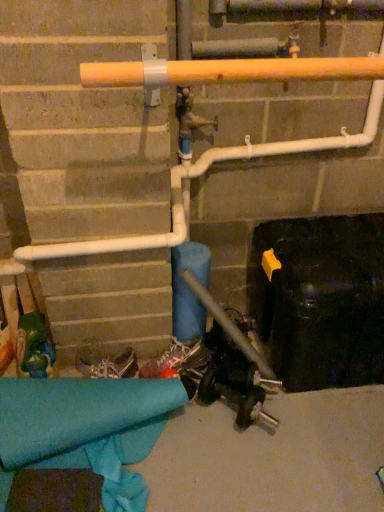
Describe the element at coordinates (170, 358) in the screenshot. The height and width of the screenshot is (512, 384). I see `white textured sneakers at center` at that location.

Where is `white textured sneakers at center`? This screenshot has width=384, height=512. white textured sneakers at center is located at coordinates (170, 358).

In order to face matte orange pipe at upper center, should I rotate leftwards or rightwards?

A 8.611 degree turn to the right will do.

Image resolution: width=384 pixels, height=512 pixels. What do you see at coordinates (229, 71) in the screenshot?
I see `matte orange pipe at upper center` at bounding box center [229, 71].

Find the location of a particular element. matte orange pipe at upper center is located at coordinates (229, 71).

This screenshot has height=512, width=384. Find the location of `white textured sneakers at center`. white textured sneakers at center is located at coordinates (170, 358).

Visually, is white textured sneakers at center positioned to the left or to the right of matte orange pipe at upper center?

From the image, it's evident that white textured sneakers at center is to the left of matte orange pipe at upper center.

From the picture: Between white textured sneakers at center and matte orange pipe at upper center, which one is positioned in front?

matte orange pipe at upper center is closer to the camera.

Is point (152, 373) farther from camera compared to point (312, 64)?

Yes, point (152, 373) is behind point (312, 64).

From the image's perspective, is white textured sneakers at center above or below matte orange pipe at upper center?

white textured sneakers at center is below matte orange pipe at upper center.

From the picture: From a real-world perspective, is white textured sneakers at center above or below matte orange pipe at upper center?

white textured sneakers at center is below matte orange pipe at upper center.

Considering the sizes of white textured sneakers at center and matte orange pipe at upper center in the image, is white textured sneakers at center wider or thinner than matte orange pipe at upper center?

In the image, white textured sneakers at center appears to be more narrow than matte orange pipe at upper center.

Considering the sizes of white textured sneakers at center and matte orange pipe at upper center in the image, is white textured sneakers at center taller or shorter than matte orange pipe at upper center?

Considering their sizes, white textured sneakers at center has more height than matte orange pipe at upper center.

Considering the relative sizes of white textured sneakers at center and matte orange pipe at upper center in the image provided, is white textured sneakers at center bigger than matte orange pipe at upper center?

No.

Is white textured sneakers at center surrounding matte orange pipe at upper center?

No.

Are white textured sneakers at center and matte orange pipe at upper center located far from each other?

No, white textured sneakers at center is not far from matte orange pipe at upper center.

Is white textured sneakers at center aimed at matte orange pipe at upper center?

No, white textured sneakers at center is not facing towards matte orange pipe at upper center.

How different are the orientations of white textured sneakers at center and matte orange pipe at upper center in degrees?

The angle between the facing direction of white textured sneakers at center and the facing direction of matte orange pipe at upper center is 17.4 degrees.

Where is `footwear on the left of matte orange pipe at upper center`? This screenshot has width=384, height=512. footwear on the left of matte orange pipe at upper center is located at coordinates (170, 358).

Which object is positioned more to the right, matte orange pipe at upper center or white textured sneakers at center?

From the viewer's perspective, matte orange pipe at upper center appears more on the right side.

Consider the image. Which is in front, matte orange pipe at upper center or white textured sneakers at center?

Positioned in front is matte orange pipe at upper center.

Does point (273, 79) lie behind point (158, 364)?

No.

From the image's perspective, would you say matte orange pipe at upper center is shown under white textured sneakers at center?

No.

From a real-world perspective, is matte orange pipe at upper center above or below white textured sneakers at center?

Clearly, from a real-world perspective, matte orange pipe at upper center is above white textured sneakers at center.

Does matte orange pipe at upper center have a greater width compared to white textured sneakers at center?

Indeed, matte orange pipe at upper center has a greater width compared to white textured sneakers at center.

Who is taller, matte orange pipe at upper center or white textured sneakers at center?

white textured sneakers at center.

Looking at the image, does matte orange pipe at upper center seem bigger or smaller compared to white textured sneakers at center?

matte orange pipe at upper center is bigger than white textured sneakers at center.

Can we say matte orange pipe at upper center lies outside white textured sneakers at center?

Yes, matte orange pipe at upper center is outside of white textured sneakers at center.

Is the surface of matte orange pipe at upper center in direct contact with white textured sneakers at center?

matte orange pipe at upper center and white textured sneakers at center are not in contact.

Is matte orange pipe at upper center facing towards white textured sneakers at center?

No, matte orange pipe at upper center is not facing towards white textured sneakers at center.

How many degrees apart are the facing directions of matte orange pipe at upper center and white textured sneakers at center?

The facing directions of matte orange pipe at upper center and white textured sneakers at center are 17.4 degrees apart.

Measure the distance from matte orange pipe at upper center to white textured sneakers at center.

matte orange pipe at upper center is 38.03 inches away from white textured sneakers at center.

You are a GUI agent. You are given a task and a screenshot of the screen. Output one action in this format:
    pyautogui.click(x=<x>, y=<y>)
    Task: Click on the footwear that appears on the left of matte orange pipe at upper center
    
    Given the screenshot: What is the action you would take?
    (x=170, y=358)

Locate an element on the screen. footwear on the left of matte orange pipe at upper center is located at coordinates [x=170, y=358].

Where is `footwear lying below the matte orange pipe at upper center (from the image's perspective)`? The height and width of the screenshot is (512, 384). footwear lying below the matte orange pipe at upper center (from the image's perspective) is located at coordinates (170, 358).